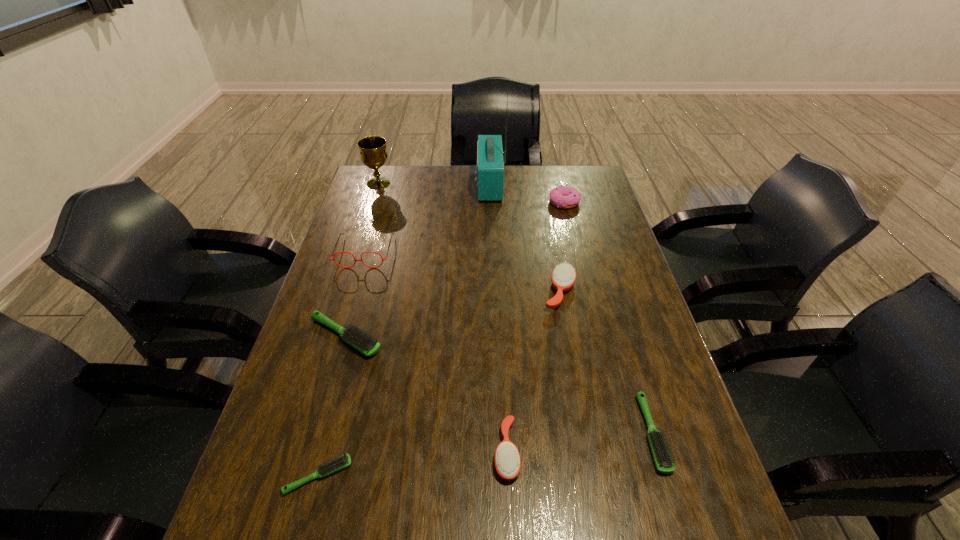
At what (x,y) coordinates should I click in order to perform the action: click on radio receiver. Please return your answer as a coordinate pair (x, y). Looking at the image, I should click on (490, 166).

The width and height of the screenshot is (960, 540). Find the location of `light radio receiver`. light radio receiver is located at coordinates (490, 166).

This screenshot has width=960, height=540. In order to click on the eighth shortest object in this screenshot , I will do `click(373, 154)`.

Identify the location of chalice. The height and width of the screenshot is (540, 960). (373, 154).

Locate an element on the screen. Image resolution: width=960 pixels, height=540 pixels. red spectacles is located at coordinates (333, 259).

The image size is (960, 540). Find the location of `the third tallest object`. the third tallest object is located at coordinates (333, 259).

The width and height of the screenshot is (960, 540). What are the coordinates of `the fifth nearest object` in the screenshot? It's located at (563, 277).

You are a GUI agent. You are given a task and a screenshot of the screen. Output one action in this format:
    pyautogui.click(x=<x>, y=<y>)
    Task: Click on the farthest hairbrush
    
    Given the screenshot: What is the action you would take?
    pyautogui.click(x=563, y=277)

The image size is (960, 540). What are the coordinates of `doughnut` in the screenshot? It's located at (565, 197).

In order to click on the farthest light hairbrush in this screenshot , I will do `click(365, 344)`.